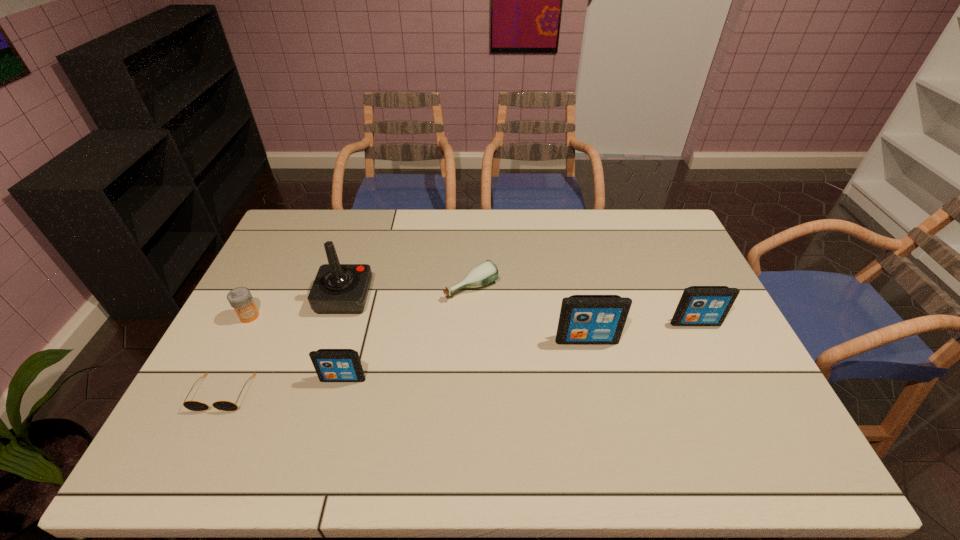
Where is `vacant position for inserting another iPod evenly`? This screenshot has height=540, width=960. vacant position for inserting another iPod evenly is located at coordinates (469, 359).